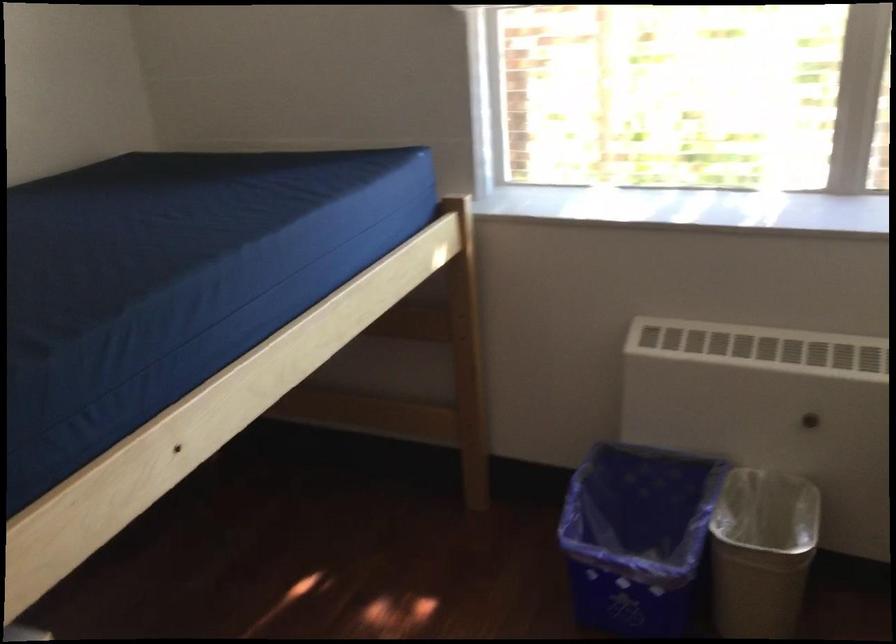
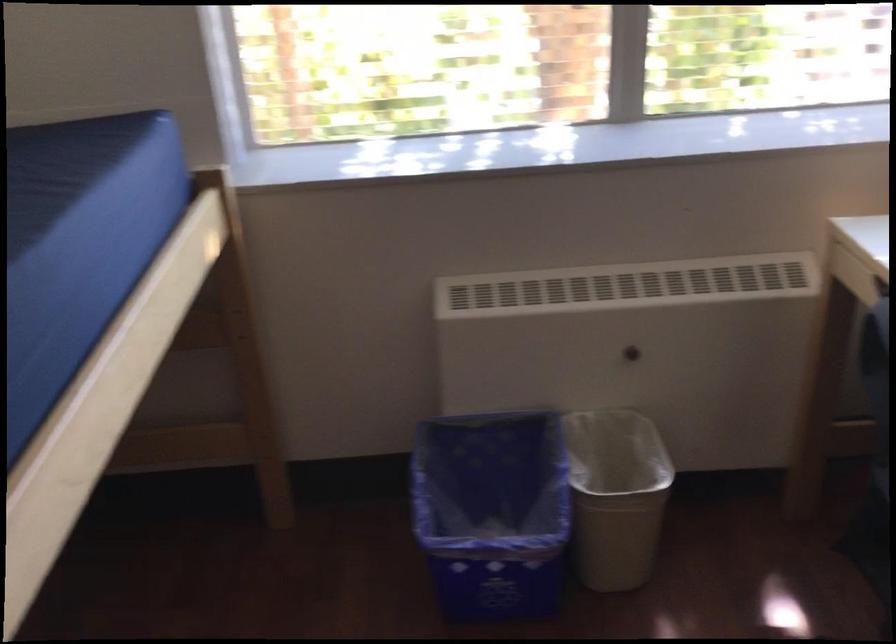
Question: The camera is either moving clockwise (left) or counter-clockwise (right) around the object. The first image is from the beginning of the video and the second image is from the end. Is the camera moving left or right when shooting the video?

Choices:
 (A) Left
 (B) Right

Answer: (A)